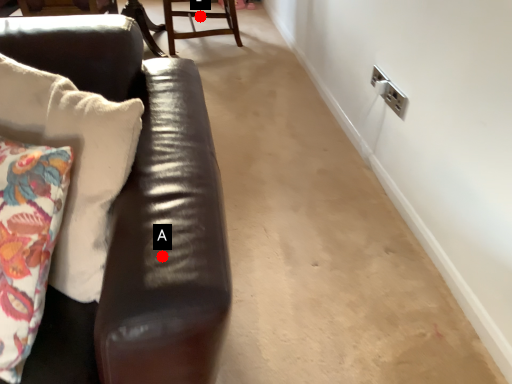
Question: Two points are circled on the image, labeled by A and B beside each circle. Which point is closer to the camera?

Choices:
 (A) A is closer
 (B) B is closer

Answer: (A)